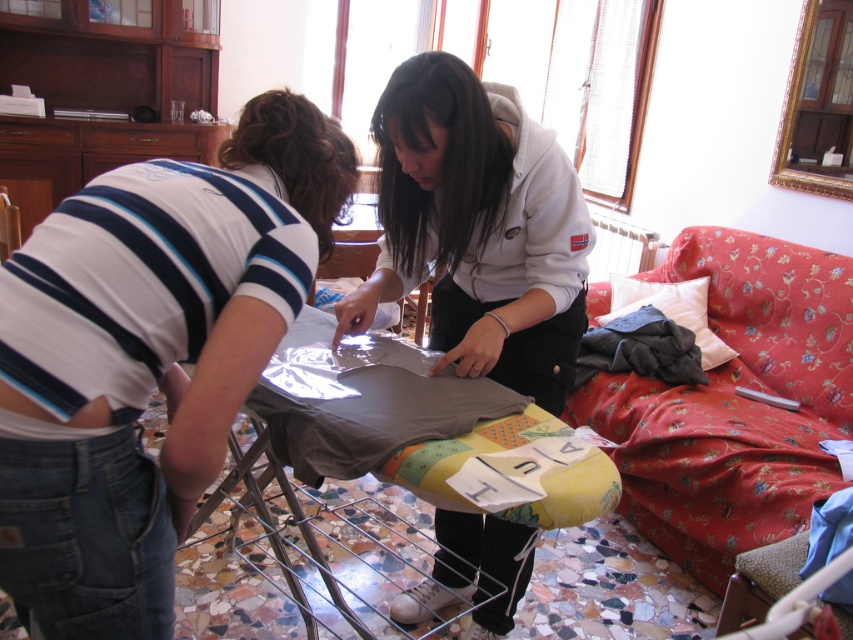
Which is in front, point (260, 260) or point (662, 285)?

Point (260, 260) is in front.

Between white striped shirt at left and white soft pillow at upper right, which one is positioned higher?

Positioned higher is white soft pillow at upper right.

Is point (54, 243) behind point (647, 301)?

No, it is in front of (647, 301).

At what (x,y) coordinates should I click in order to perform the action: click on white striped shirt at left. Please return your answer as a coordinate pair (x, y). Image resolution: width=853 pixels, height=640 pixels. Looking at the image, I should click on (148, 356).

Measure the distance from white striped shirt at left to dark gray fabric at center.

The distance of white striped shirt at left from dark gray fabric at center is 1.80 meters.

Is point (332, 177) positioned behind point (618, 368)?

No, it is in front of (618, 368).

Where is `white striped shirt at left`? The width and height of the screenshot is (853, 640). white striped shirt at left is located at coordinates (148, 356).

The image size is (853, 640). In order to click on white striped shirt at left in this screenshot , I will do `click(148, 356)`.

Between white striped shirt at left and matte gray hoodie at center, which one is positioned higher?

matte gray hoodie at center is above.

Between point (170, 209) and point (395, 284), which one is positioned behind?

Point (395, 284)

Is point (289, 115) positioned in front of point (424, 202)?

Yes, point (289, 115) is closer to viewer.

Where is `white striped shirt at left`? The width and height of the screenshot is (853, 640). white striped shirt at left is located at coordinates (148, 356).